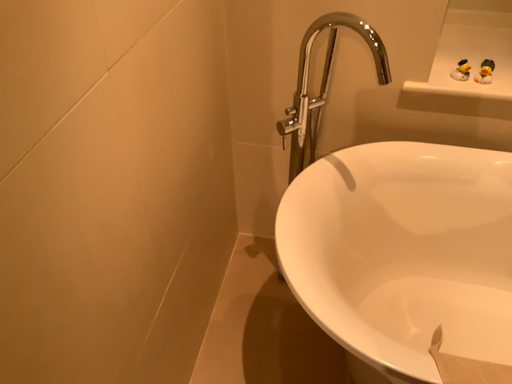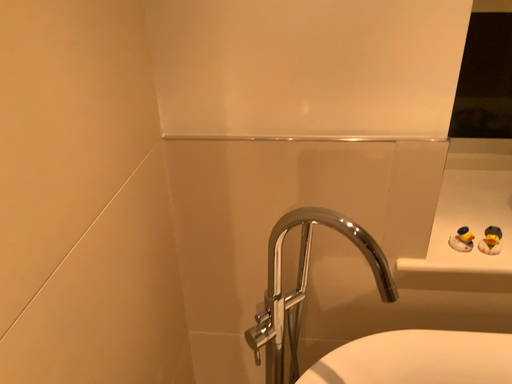
Question: Which way did the camera rotate in the video?

Choices:
 (A) rotated upward
 (B) rotated downward

Answer: (A)